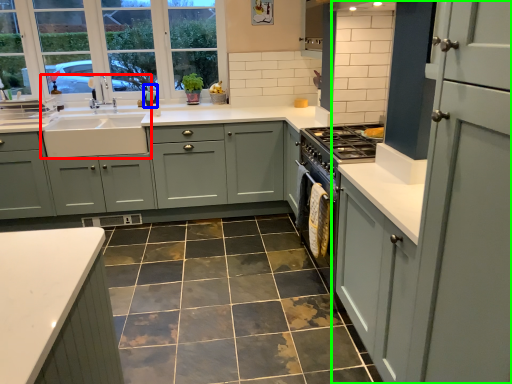
Question: Estimate the real-world distances between objects in this image. Which object is farther from sink (highlighted by a red box), teal (highlighted by a blue box) or cabinetry (highlighted by a green box)?

Choices:
 (A) teal
 (B) cabinetry

Answer: (B)